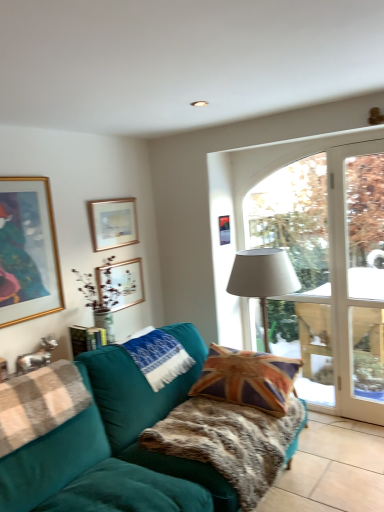
The width and height of the screenshot is (384, 512). In order to click on vacant space in front of white glass door at right in this screenshot , I will do `click(374, 437)`.